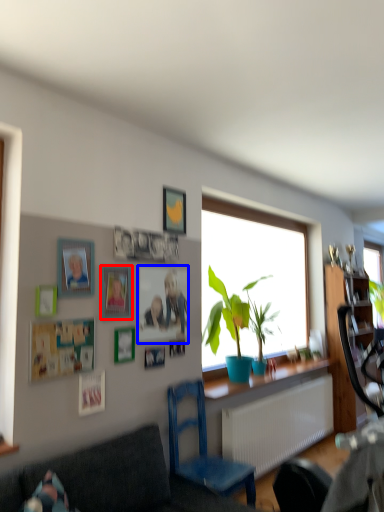
Question: Which of the following is the closest to the observer, picture frame (highlighted by a red box) or picture frame (highlighted by a blue box)?

Choices:
 (A) picture frame
 (B) picture frame

Answer: (A)